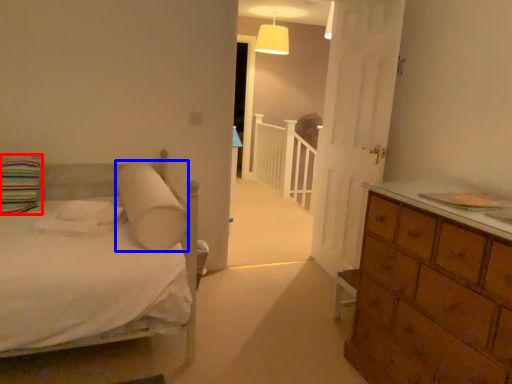
Question: Which object is closer to the camera taking this photo, pillow (highlighted by a red box) or pillow (highlighted by a blue box)?

Choices:
 (A) pillow
 (B) pillow

Answer: (B)